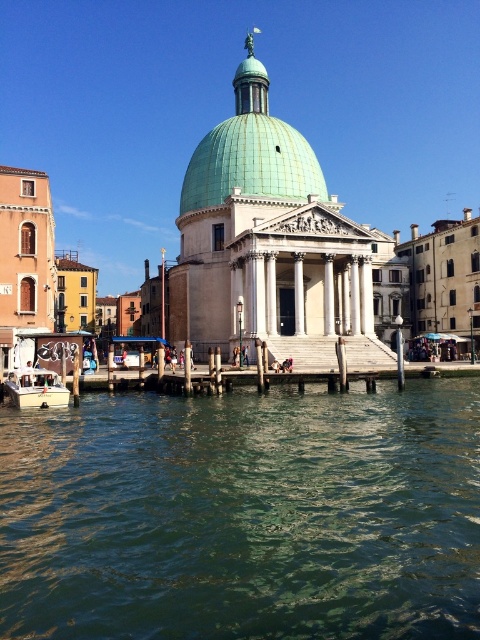
Is greenish water at center further to the viewer compared to white plastic boat at lower left?

No, it is not.

Does greenish water at center lie in front of white plastic boat at lower left?

Yes, it is.

Identify the location of greenish water at center. Image resolution: width=480 pixels, height=640 pixels. click(x=243, y=515).

Does green glazed dome at center come behind white plastic boat at lower left?

Yes, green glazed dome at center is further from the viewer.

This screenshot has height=640, width=480. In order to click on green glazed dome at center in this screenshot , I will do `click(251, 150)`.

Is greenish water at center closer to the viewer compared to green glazed dome at center?

Yes, greenish water at center is in front of green glazed dome at center.

Does point (308, 632) come in front of point (223, 141)?

Yes, it is.

The width and height of the screenshot is (480, 640). Find the location of `greenish water at center`. greenish water at center is located at coordinates (243, 515).